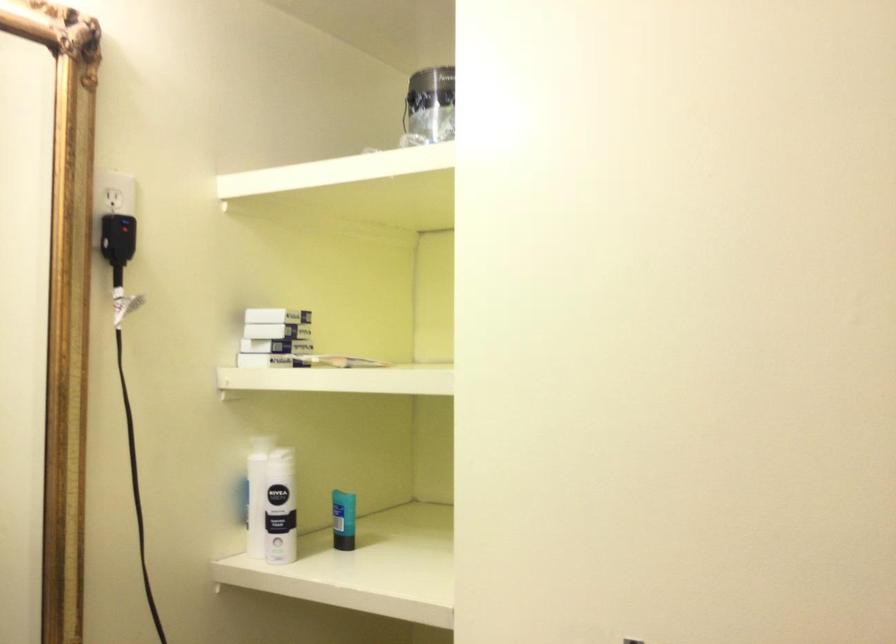
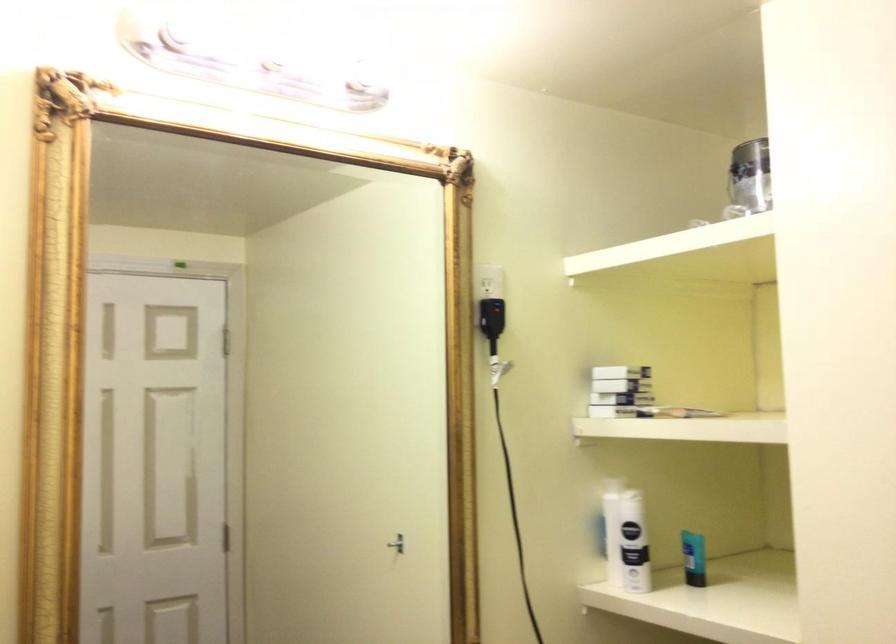
Consider the image. In a continuous first-person perspective shot, in which direction is the camera moving?

The cameraman walked toward right, backward.